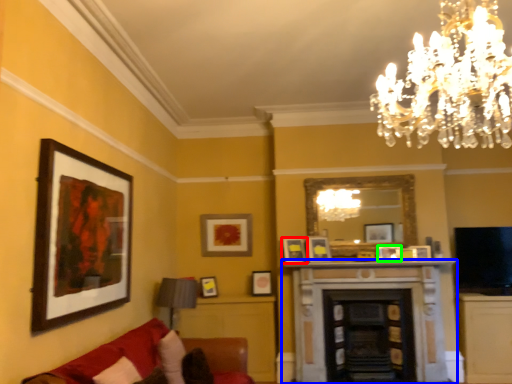
Question: Considering the real-world distances, which object is farthest from picture frame (highlighted by a red box)? fireplace (highlighted by a blue box) or picture frame (highlighted by a green box)?

Choices:
 (A) fireplace
 (B) picture frame

Answer: (B)